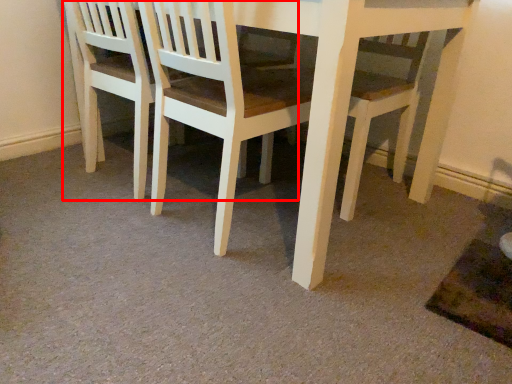
Question: In this image, where is chair (annotated by the red box) located relative to chair?

Choices:
 (A) left
 (B) right

Answer: (A)